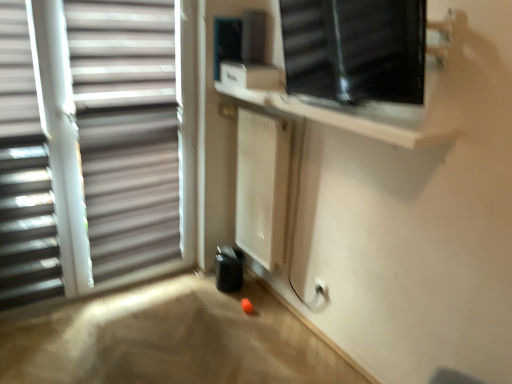
Locate an element on the screen. empty space that is to the right of white matte window at left, which is counted as the 2th window, starting from the right is located at coordinates (186, 317).